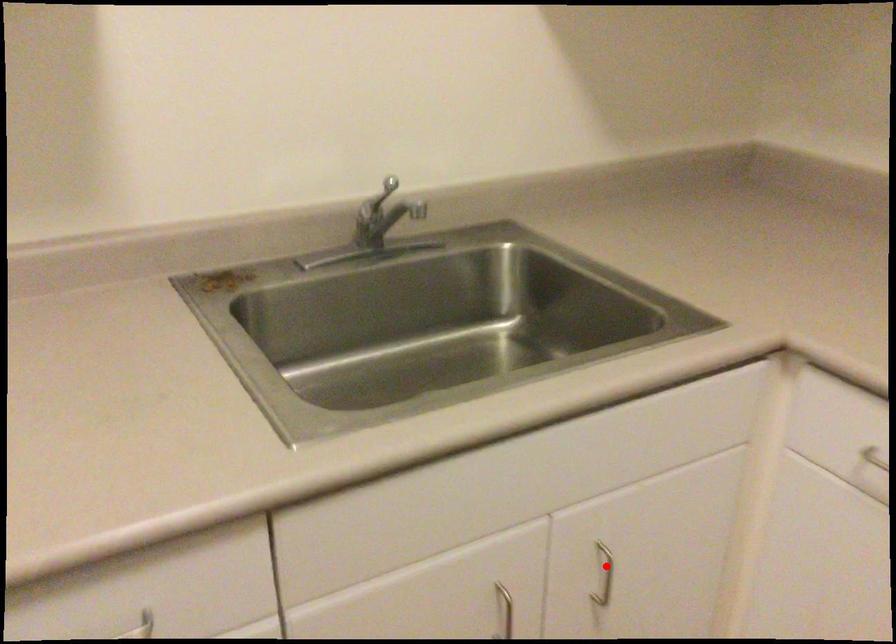
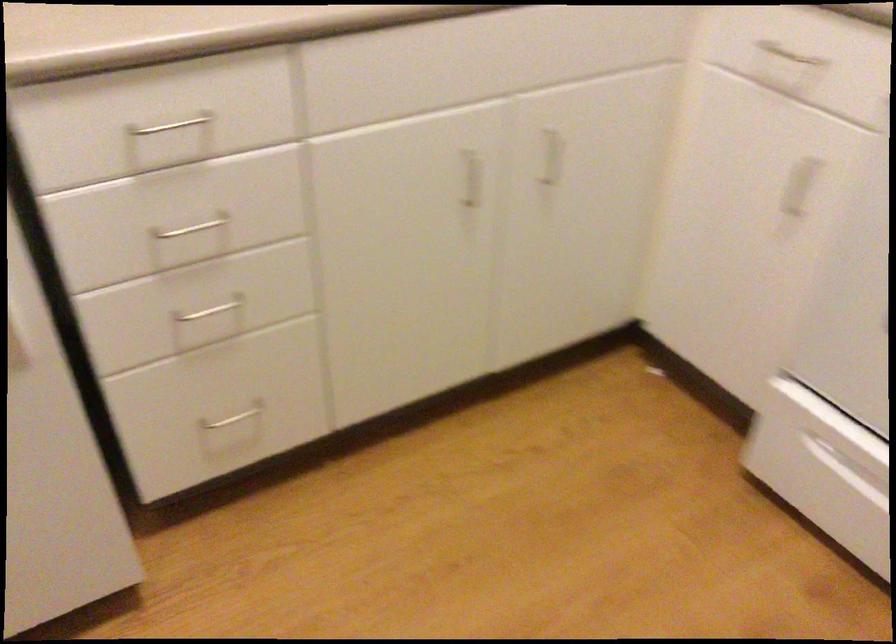
The point at the highlighted location is marked in the first image. Where is the corresponding point in the second image?

(552, 156)